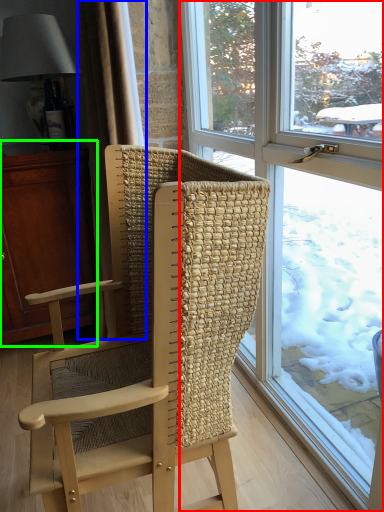
Question: Based on their relative distances, which object is farther from window (highlighted by a red box)? Choose from curtain (highlighted by a blue box) and cabinetry (highlighted by a green box).

Choices:
 (A) curtain
 (B) cabinetry

Answer: (B)